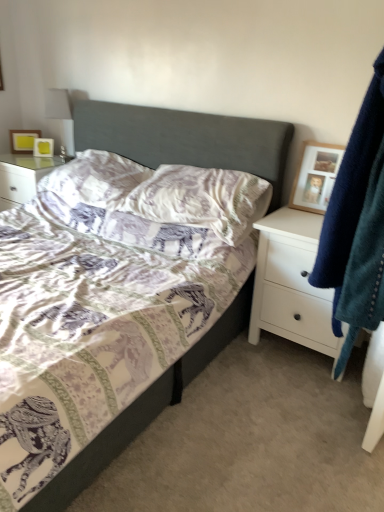
Question: Is point (324, 160) closer or farther from the camera than point (221, 181)?

Choices:
 (A) closer
 (B) farther

Answer: (A)

Question: Is wooden picture frame at upper right, which is the 1th picture frame in right-to-left order, bigger or smaller than purple elephant-patterned pillow at center, arranged as the second pillow when viewed from the left?

Choices:
 (A) small
 (B) big

Answer: (A)

Question: Which of these objects is positioned farthest from the matte yellow picture frame at upper left, which is the second picture frame in right-to-left order?

Choices:
 (A) white matte chest of drawers at right
 (B) matte yellow picture frame at upper left, which ranks as the third picture frame in front-to-back order
 (C) textured gray bed at center
 (D) wooden picture frame at upper right, which is the 1th picture frame in front-to-back order
 (E) velvety blue robe at right

Answer: (E)

Question: Which object is the closest to the textured gray bed at center?

Choices:
 (A) printed fabric pillow at center, acting as the 2th pillow starting from the right
 (B) matte yellow picture frame at upper left, which ranks as the third picture frame in front-to-back order
 (C) purple elephant-patterned pillow at center, the first pillow positioned from the right
 (D) wooden picture frame at upper right, marked as the first picture frame in a bottom-to-top arrangement
 (E) matte yellow picture frame at upper left, marked as the 2th picture frame in a bottom-to-top arrangement

Answer: (C)